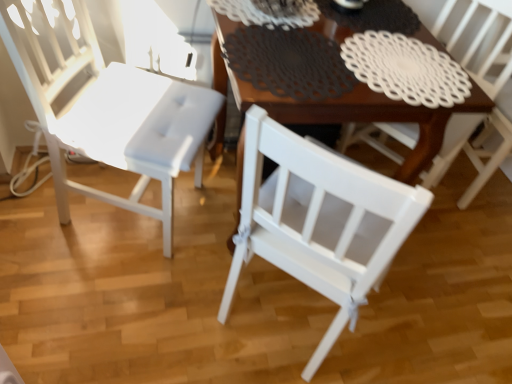
Question: From a real-world perspective, is wooden table at center on top of white matte chair at center, which is the 2th chair from left to right?

Choices:
 (A) yes
 (B) no

Answer: (B)

Question: From the image's perspective, is wooden table at center under white matte chair at center, which is the 2th chair from left to right?

Choices:
 (A) yes
 (B) no

Answer: (A)

Question: Considering the relative sizes of wooden table at center and white matte chair at center, the first chair when ordered from right to left, in the image provided, is wooden table at center wider than white matte chair at center, the first chair when ordered from right to left,?

Choices:
 (A) yes
 (B) no

Answer: (A)

Question: Would you consider wooden table at center to be distant from white matte chair at center, the first chair when ordered from right to left?

Choices:
 (A) no
 (B) yes

Answer: (A)

Question: Considering the relative sizes of wooden table at center and white matte chair at center, the first chair when ordered from right to left, in the image provided, is wooden table at center taller than white matte chair at center, the first chair when ordered from right to left,?

Choices:
 (A) no
 (B) yes

Answer: (A)

Question: Could white matte chair at center, the first chair when ordered from right to left, be considered to be inside wooden table at center?

Choices:
 (A) yes
 (B) no

Answer: (B)

Question: From a real-world perspective, is wooden table at center on white matte chair at left, marked as the 1th chair in a left-to-right arrangement?

Choices:
 (A) yes
 (B) no

Answer: (B)

Question: Is wooden table at center to the left of white matte chair at left, marked as the 1th chair in a left-to-right arrangement, from the viewer's perspective?

Choices:
 (A) yes
 (B) no

Answer: (B)

Question: Considering the relative sizes of wooden table at center and white matte chair at left, the 2th chair when ordered from right to left, in the image provided, is wooden table at center wider than white matte chair at left, the 2th chair when ordered from right to left,?

Choices:
 (A) yes
 (B) no

Answer: (A)

Question: Is wooden table at center bigger than white matte chair at left, marked as the 1th chair in a left-to-right arrangement?

Choices:
 (A) no
 (B) yes

Answer: (B)

Question: From the image's perspective, is wooden table at center on top of white matte chair at left, the 2th chair when ordered from right to left?

Choices:
 (A) yes
 (B) no

Answer: (B)

Question: Is wooden table at center further to camera compared to white matte chair at left, the 2th chair when ordered from right to left?

Choices:
 (A) no
 (B) yes

Answer: (B)

Question: Are white matte chair at left, marked as the 1th chair in a left-to-right arrangement, and wooden table at center beside each other?

Choices:
 (A) yes
 (B) no

Answer: (B)